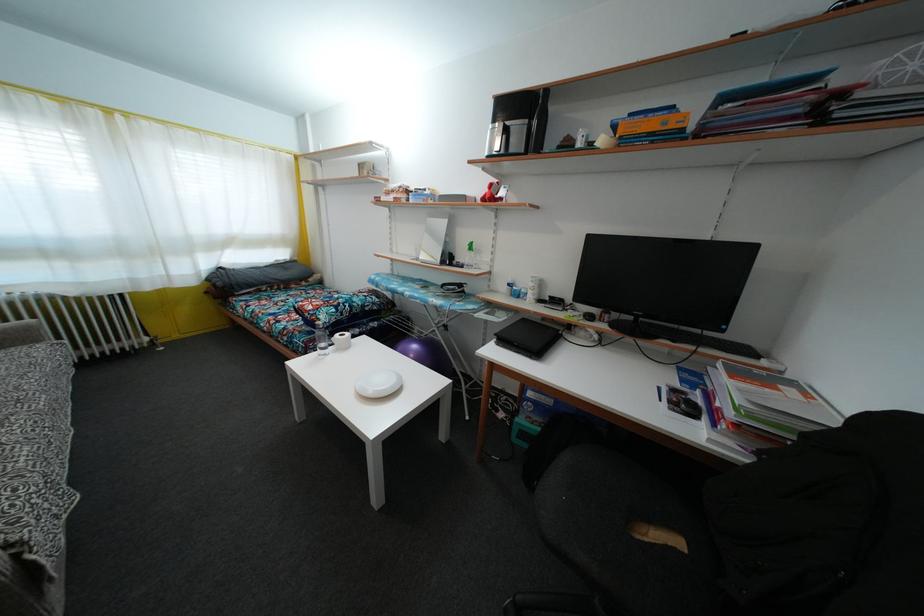
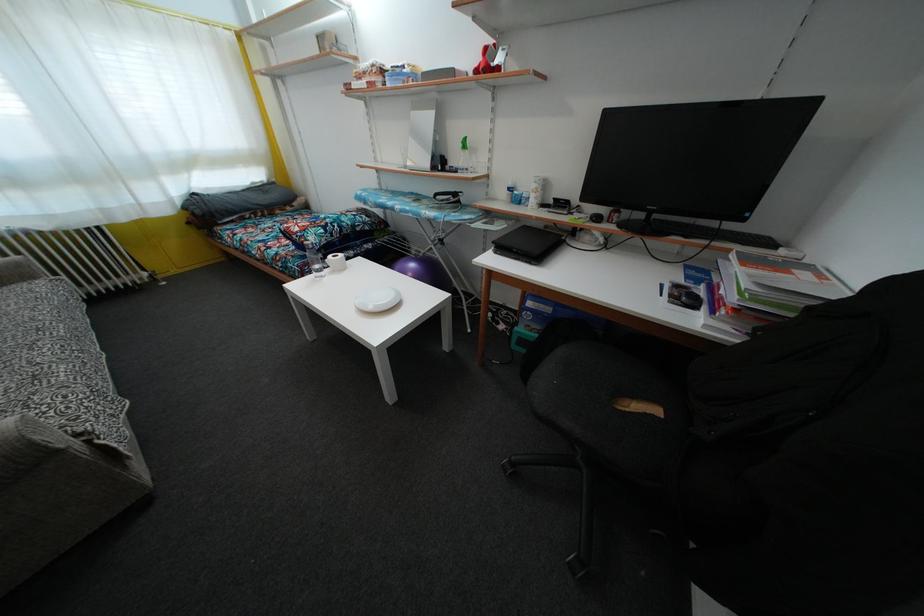
In the second image, find the point that corresponds to the point at 494,193 in the first image.

(490, 58)